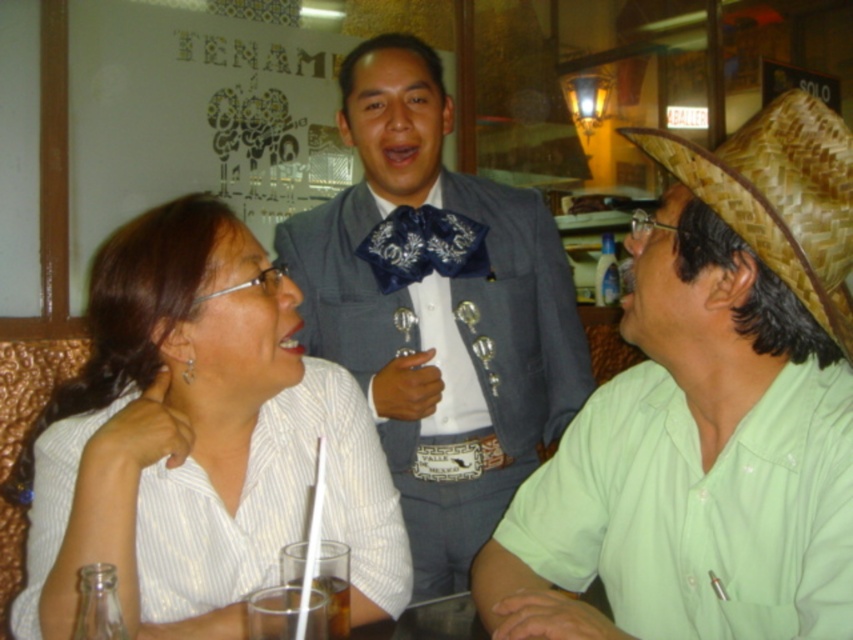
You are a photographer standing in front of the scene. You want to take a photo focusing on the dark blue satin bow tie at center without the matte gray suit at center blocking it. Is this possible based on their positions?

The matte gray suit at center is closer to the viewer than dark blue satin bow tie at center, so the matte gray suit at center would block the view of the dark blue satin bow tie at center. Therefore, it is not possible to take a photo focusing on the dark blue satin bow tie at center without the matte gray suit at center blocking it.

You are a waiter in a busy restaurant. You need to deliver a dessert to the table where the dark blue satin bow tie at center and the translucent glass at table center are located. The dessert plate is 12 inches in diameter. Can you place the dessert between these two items without moving them?

The dark blue satin bow tie at center and the translucent glass at table center are 34.08 inches apart, so yes, the dessert plate of 12 inches in diameter can be placed between them as there is sufficient space.

Please describe the exact position of the woven straw cowboy hat at right in terms of coordinates within the image frame. The image frame has a coordinate system where the bottom left corner is the origin point. The x and y axes increase to the right and upward respectively. The coordinates are normalized between 0 and 1. Please provide the coordinates as a pair in parentheses, like this example format, e.g., 0.5, 0.5. The answer must be precise and only include the coordinates without any additional text.

The woven straw cowboy hat at right is located at coordinates (779, 196).